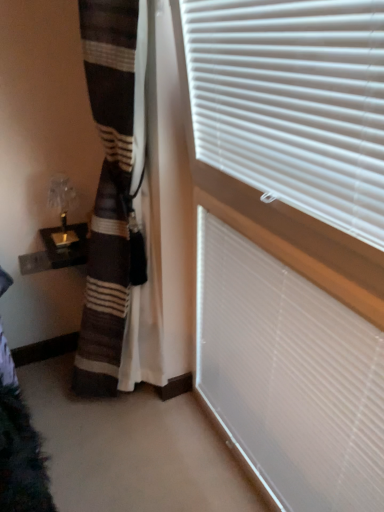
Question: Can you confirm if white matte window blind at upper right, which is counted as the 2th window blind, starting from the top, is positioned to the left of white plastic blinds at upper right, which ranks as the 1th window blind in top-to-bottom order?

Choices:
 (A) yes
 (B) no

Answer: (B)

Question: Does white matte window blind at upper right, which is counted as the 2th window blind, starting from the top, have a lesser height compared to white plastic blinds at upper right, which ranks as the 1th window blind in top-to-bottom order?

Choices:
 (A) yes
 (B) no

Answer: (B)

Question: Is white plastic blinds at upper right, which ranks as the 1th window blind in top-to-bottom order, surrounded by white matte window blind at upper right, which is counted as the 2th window blind, starting from the top?

Choices:
 (A) no
 (B) yes

Answer: (A)

Question: Is white matte window blind at upper right, positioned as the first window blind in bottom-to-top order, bigger than white plastic blinds at upper right, which ranks as the 1th window blind in top-to-bottom order?

Choices:
 (A) yes
 (B) no

Answer: (B)

Question: Is white matte window blind at upper right, which is counted as the 2th window blind, starting from the top, smaller than white plastic blinds at upper right, acting as the second window blind starting from the bottom?

Choices:
 (A) yes
 (B) no

Answer: (A)

Question: Is white matte window blind at upper right, positioned as the first window blind in bottom-to-top order, further to the viewer compared to white plastic blinds at upper right, which ranks as the 1th window blind in top-to-bottom order?

Choices:
 (A) no
 (B) yes

Answer: (B)

Question: Can you confirm if white plastic blinds at upper right, which ranks as the 1th window blind in top-to-bottom order, is bigger than white matte window blind at upper right, which is counted as the 2th window blind, starting from the top?

Choices:
 (A) yes
 (B) no

Answer: (A)

Question: Is white plastic blinds at upper right, acting as the second window blind starting from the bottom, oriented towards white matte window blind at upper right, which is counted as the 2th window blind, starting from the top?

Choices:
 (A) yes
 (B) no

Answer: (B)

Question: From the image's perspective, is white plastic blinds at upper right, acting as the second window blind starting from the bottom, over white matte window blind at upper right, positioned as the first window blind in bottom-to-top order?

Choices:
 (A) yes
 (B) no

Answer: (A)

Question: Is white plastic blinds at upper right, acting as the second window blind starting from the bottom, further to camera compared to white matte window blind at upper right, positioned as the first window blind in bottom-to-top order?

Choices:
 (A) yes
 (B) no

Answer: (B)

Question: Would you say white plastic blinds at upper right, acting as the second window blind starting from the bottom, is a long distance from white matte window blind at upper right, positioned as the first window blind in bottom-to-top order?

Choices:
 (A) yes
 (B) no

Answer: (B)

Question: Considering the relative positions of white plastic blinds at upper right, which ranks as the 1th window blind in top-to-bottom order, and white matte window blind at upper right, positioned as the first window blind in bottom-to-top order, in the image provided, is white plastic blinds at upper right, which ranks as the 1th window blind in top-to-bottom order, to the left of white matte window blind at upper right, positioned as the first window blind in bottom-to-top order, from the viewer's perspective?

Choices:
 (A) yes
 (B) no

Answer: (A)

Question: Looking at the image, does white matte window blind at upper right, positioned as the first window blind in bottom-to-top order, seem bigger or smaller compared to white plastic blinds at upper right, acting as the second window blind starting from the bottom?

Choices:
 (A) small
 (B) big

Answer: (A)